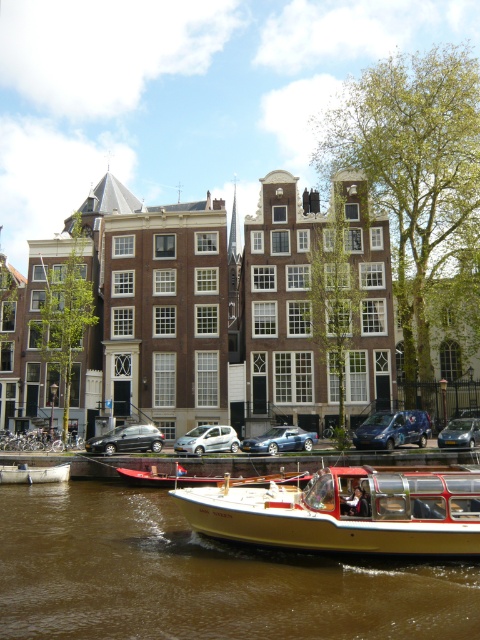
You are standing on the canal boat with a red roof and white body and want to take a photo of the two points mentioned. Which point is closer to you, point at (403, 442) or point at (183, 451)?

Point at (403, 442) is closer to you than point at (183, 451) because it is further to the viewer.

You are standing at the point marked by coordinates point (x=344, y=512) in the canal scene. What object are you directly on top of?

You are directly on top of the gold polished wood boat at lower center marked by point (x=344, y=512).

You are standing on the canal boat with a red roof and white body. You see two points marked on the buildings in the scene. Which point is closer to you, point at coordinates (394, 436) or point at coordinates (457, 433)?

Point at coordinates (394, 436) is closer to you than point at coordinates (457, 433).